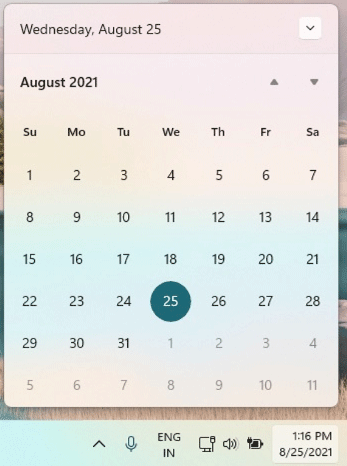
The height and width of the screenshot is (466, 347). I want to click on speaker and microphone, so click(229, 445), click(128, 445).